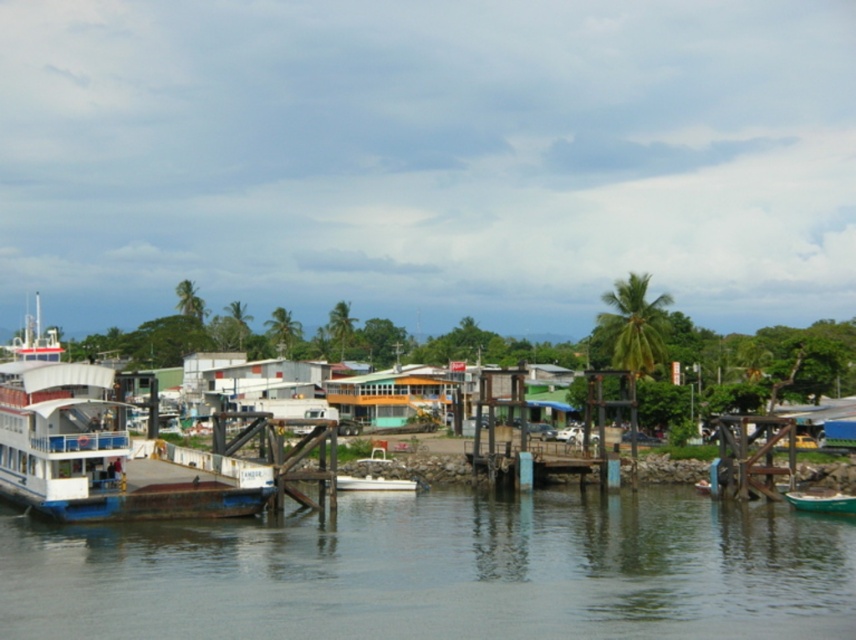
Question: Does rusty metal dock at center come in front of green matte boat at lower right?

Choices:
 (A) yes
 (B) no

Answer: (B)

Question: Does white matte boat at left have a smaller size compared to white matte boat at center?

Choices:
 (A) yes
 (B) no

Answer: (B)

Question: Is rusty metal dock at center smaller than green matte boat at lower right?

Choices:
 (A) no
 (B) yes

Answer: (A)

Question: Which point appears closest to the camera in this image?

Choices:
 (A) (502, 499)
 (B) (635, 416)
 (C) (214, 486)
 (D) (339, 477)

Answer: (C)

Question: Which of these objects is positioned closest to the white matte boat at center?

Choices:
 (A) wooden dock at center-right
 (B) rusty metal dock at center
 (C) white matte boat at left
 (D) green water at lower center

Answer: (A)

Question: Estimate the real-world distances between objects in this image. Which object is farther from the green water at lower center?

Choices:
 (A) white matte boat at left
 (B) green matte boat at lower right
 (C) rusty metal dock at center

Answer: (B)